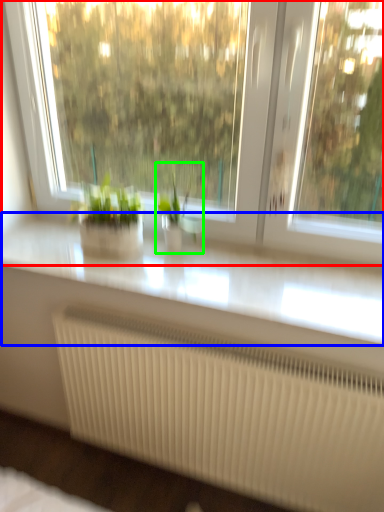
Question: Based on their relative distances, which object is farther from window (highlighted by a red box)? Choose from counter top (highlighted by a blue box) and houseplant (highlighted by a green box).

Choices:
 (A) counter top
 (B) houseplant

Answer: (B)